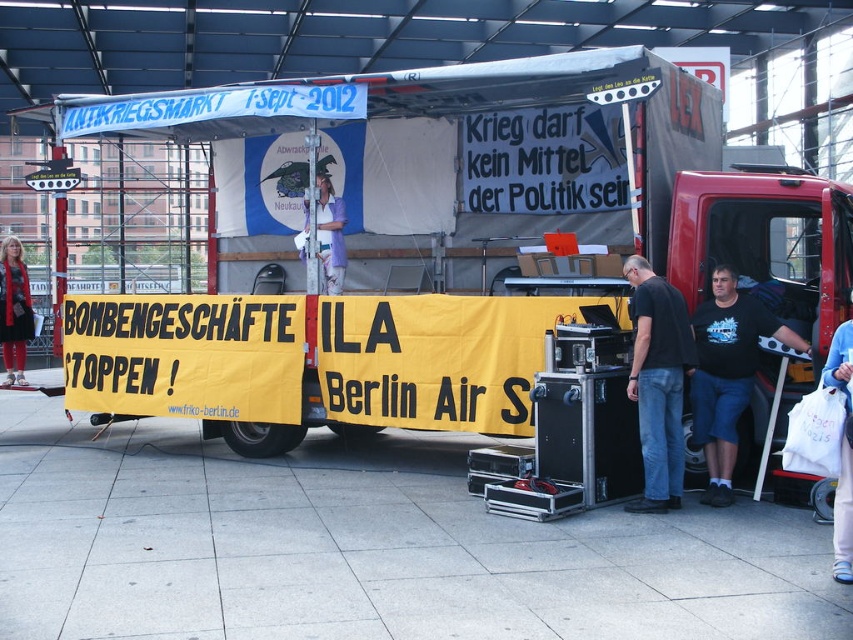
Who is lower down, matte black truck at right or black matte shirt at center?

black matte shirt at center is below.

Does point (808, 340) come closer to viewer compared to point (653, 381)?

No, (808, 340) is further to viewer.

The width and height of the screenshot is (853, 640). Identify the location of matte black truck at right. (767, 250).

Does yellow fabric banner at center have a greater width compared to matte black jacket at lower left?

Yes, yellow fabric banner at center is wider than matte black jacket at lower left.

Who is taller, yellow fabric banner at center or matte black jacket at lower left?

With more height is matte black jacket at lower left.

The image size is (853, 640). Describe the element at coordinates (306, 362) in the screenshot. I see `yellow fabric banner at center` at that location.

At what (x,y) coordinates should I click in order to perform the action: click on yellow fabric banner at center. Please return your answer as a coordinate pair (x, y). The width and height of the screenshot is (853, 640). Looking at the image, I should click on (306, 362).

Who is positioned more to the left, matte black truck at right or white fabric at center?

Positioned to the left is white fabric at center.

Is matte black truck at right below white fabric at center?

Correct, matte black truck at right is located below white fabric at center.

Find the location of a particular element. matte black truck at right is located at coordinates (767, 250).